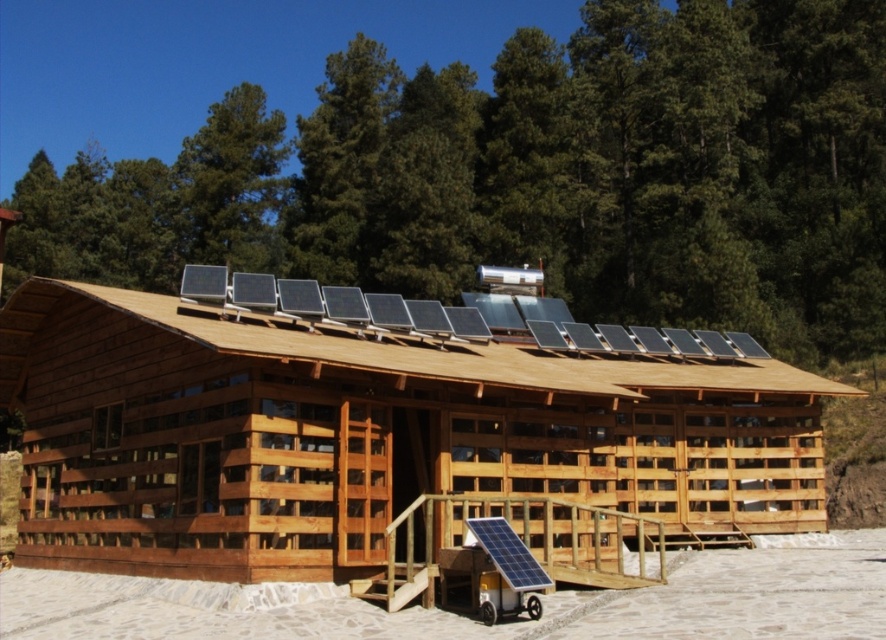
You are a visitor approaching the natural wood hut at center and wooden solar panels at center. Which object would you see first as you walk towards them from a distance?

The natural wood hut at center is much taller than the wooden solar panels at center, so you would see the natural wood hut at center first as it stands higher and would be visible from a greater distance.